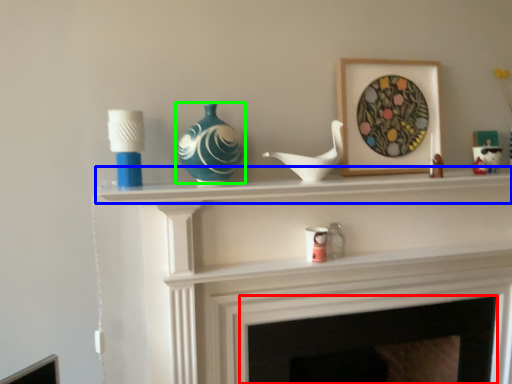
Question: Which is farther away from fireplace (highlighted by a red box)? mantle (highlighted by a blue box) or vase (highlighted by a green box)?

Choices:
 (A) mantle
 (B) vase

Answer: (B)